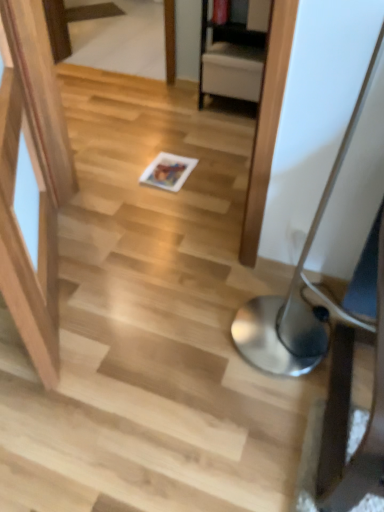
Where is `free space above white glossy magazine at center (from a real-world perspective)`? free space above white glossy magazine at center (from a real-world perspective) is located at coordinates (167, 169).